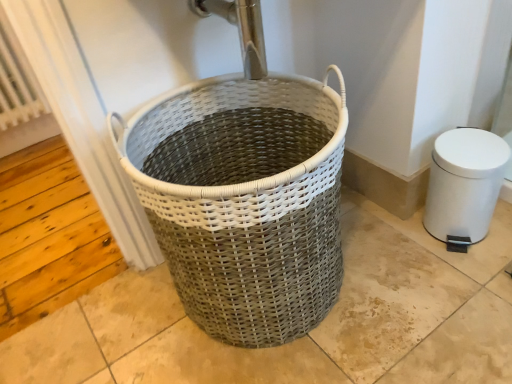
This screenshot has height=384, width=512. What are the coordinates of `free space above white plastic bidet at right (from a real-world perspective)` in the screenshot? It's located at (471, 153).